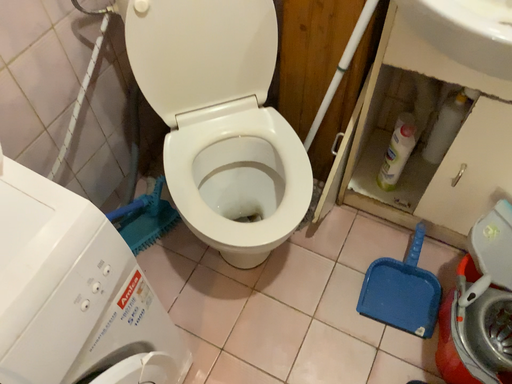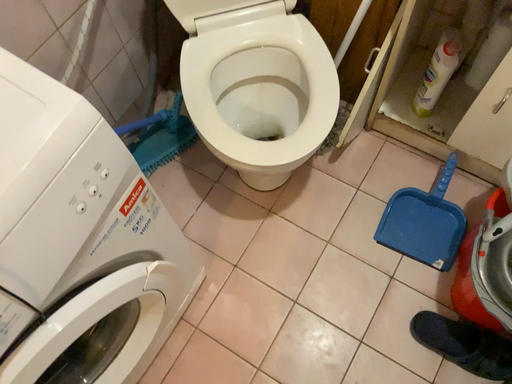
Question: How did the camera likely rotate when shooting the video?

Choices:
 (A) rotated downward
 (B) rotated upward

Answer: (A)